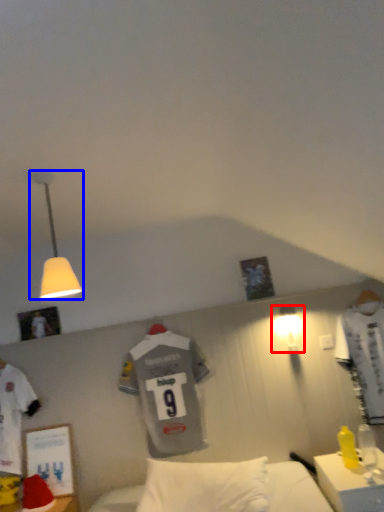
Question: Among these objects, which one is farthest to the camera, lamp (highlighted by a red box) or lamp (highlighted by a blue box)?

Choices:
 (A) lamp
 (B) lamp

Answer: (A)